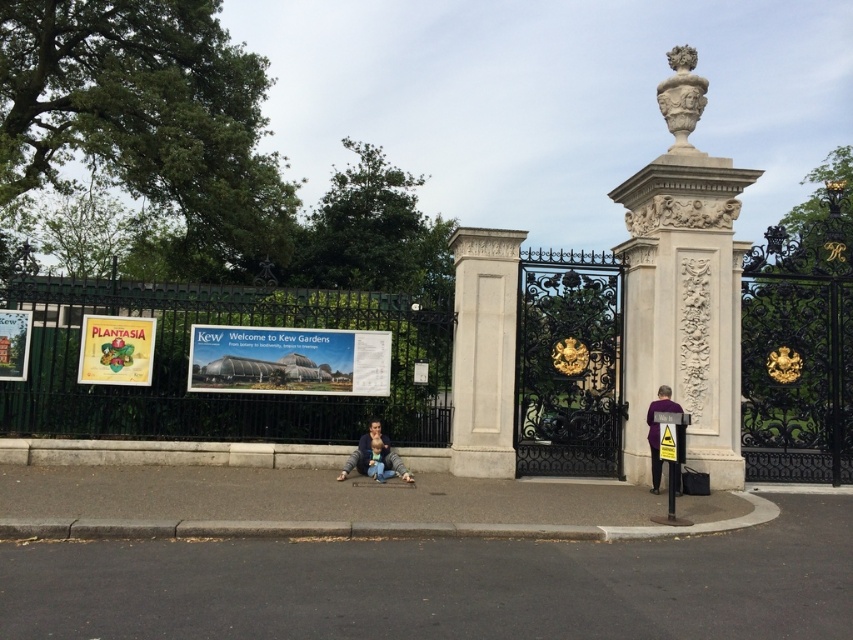
Does green wrought iron fence at center appear on the right side of purple fabric jacket at lower right?

Incorrect, green wrought iron fence at center is not on the right side of purple fabric jacket at lower right.

Does green wrought iron fence at center come in front of purple fabric jacket at lower right?

No, green wrought iron fence at center is behind purple fabric jacket at lower right.

You are a GUI agent. You are given a task and a screenshot of the screen. Output one action in this format:
    pyautogui.click(x=<x>, y=<y>)
    Task: Click on the green wrought iron fence at center
    The image size is (853, 640).
    Given the screenshot: What is the action you would take?
    pyautogui.click(x=219, y=392)

Does point (363, 461) lie behind point (654, 440)?

Yes, it is.

Who is lower down, matte blue jacket at center or purple fabric jacket at lower right?

matte blue jacket at center is below.

Which is behind, point (369, 451) or point (654, 456)?

The point (369, 451) is behind.

Where is `matte blue jacket at center`? matte blue jacket at center is located at coordinates (x=369, y=454).

Can you confirm if green wrought iron fence at center is taller than white marble statue at upper right?

Indeed, green wrought iron fence at center has a greater height compared to white marble statue at upper right.

This screenshot has width=853, height=640. Find the location of `green wrought iron fence at center`. green wrought iron fence at center is located at coordinates (219, 392).

You are a GUI agent. You are given a task and a screenshot of the screen. Output one action in this format:
    pyautogui.click(x=<x>, y=<y>)
    Task: Click on the green wrought iron fence at center
    
    Given the screenshot: What is the action you would take?
    pyautogui.click(x=219, y=392)

Locate an element on the screen. This screenshot has width=853, height=640. green wrought iron fence at center is located at coordinates (219, 392).